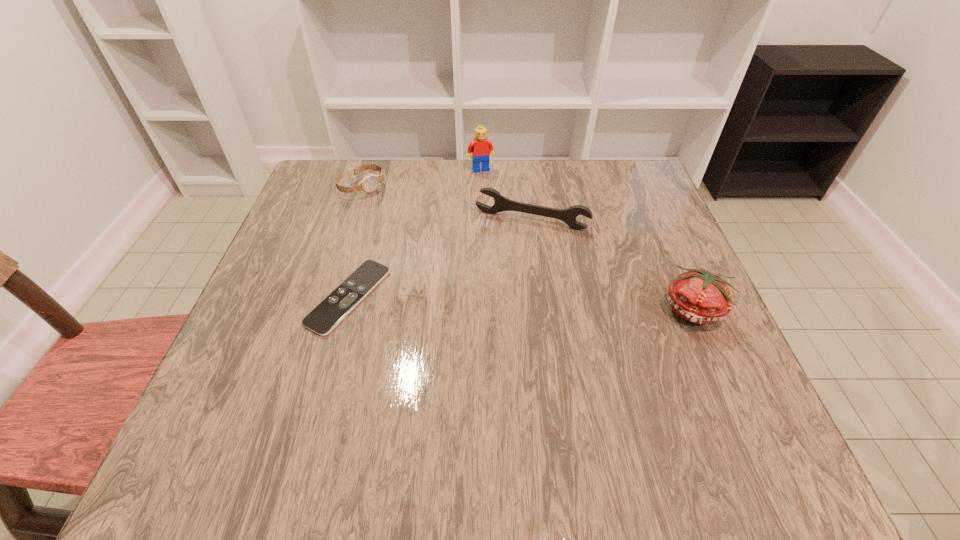
The height and width of the screenshot is (540, 960). I want to click on wrench at the far edge, so click(x=501, y=203).

The height and width of the screenshot is (540, 960). What are the coordinates of `watch that is at the far edge` in the screenshot? It's located at (370, 182).

You are a GUI agent. You are given a task and a screenshot of the screen. Output one action in this format:
    pyautogui.click(x=<x>, y=<y>)
    Task: Click on the Lego that is at the far edge
    The image size is (960, 540).
    Given the screenshot: What is the action you would take?
    pyautogui.click(x=481, y=148)

Where is `remote control located in the left edge section of the desktop`? remote control located in the left edge section of the desktop is located at coordinates (336, 306).

I want to click on watch that is at the left edge, so click(370, 182).

Locate an element on the screen. object situated at the right edge is located at coordinates (698, 296).

Locate an element on the screen. Image resolution: width=960 pixels, height=540 pixels. object present at the far left corner is located at coordinates (370, 182).

The image size is (960, 540). I want to click on vacant space at the far edge of the desktop, so click(391, 171).

At what (x,y) coordinates should I click in order to perform the action: click on vacant space at the near edge of the desktop. Please return your answer as a coordinate pair (x, y). Looking at the image, I should click on (627, 385).

This screenshot has height=540, width=960. In the image, there is a desktop. What are the coordinates of `vacant space at the left edge` in the screenshot? It's located at (357, 217).